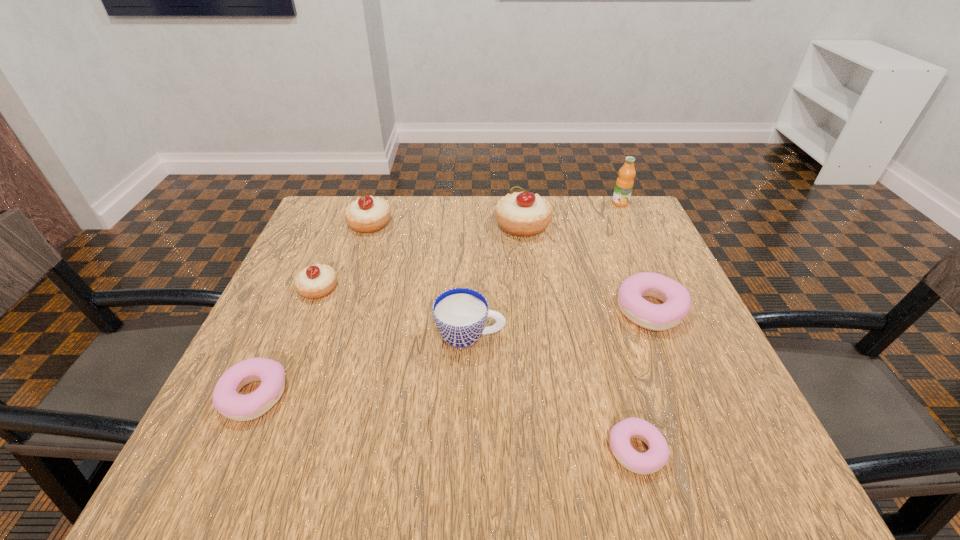
The width and height of the screenshot is (960, 540). What are the coordinates of `the second smallest pink pastry` in the screenshot? It's located at (238, 407).

Identify the location of the seventh tallest object. Image resolution: width=960 pixels, height=540 pixels. (238, 407).

The width and height of the screenshot is (960, 540). What are the coordinates of `the shortest pastry` in the screenshot? It's located at (651, 461).

Where is `the shortest object`? the shortest object is located at coordinates (651, 461).

You are a GUI agent. You are given a task and a screenshot of the screen. Output one action in this format:
    pyautogui.click(x=<x>, y=<y>)
    Task: Click on the vacant point located 0.330m on the label of the orange juice
    The width and height of the screenshot is (960, 540).
    Given the screenshot: What is the action you would take?
    pyautogui.click(x=658, y=286)

At what (x,y) coordinates should I click in order to perform the action: click on free space located on the front of the biggest beige pastry. Please return your answer as a coordinate pair (x, y). The width and height of the screenshot is (960, 540). Looking at the image, I should click on (537, 337).

At what (x,y) coordinates should I click in order to perform the action: click on vacant space located on the right of the fifth shortest pastry. Please return your answer as a coordinate pair (x, y). This screenshot has width=960, height=540. Looking at the image, I should click on (444, 224).

The width and height of the screenshot is (960, 540). Identify the location of vacant region located 0.120m on the side of the blue cup with the handle. (564, 336).

Identify the location of vacant space located 0.220m on the front of the nearest beige pastry. (278, 389).

This screenshot has width=960, height=540. I want to click on vacant space situated on the back of the farthest pink pastry, so click(x=627, y=251).